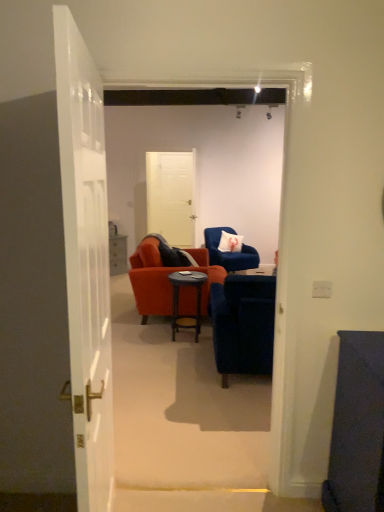
Question: In terms of width, does white glossy door at left, marked as the first door in a front-to-back arrangement, look wider or thinner when compared to velvet blue armchair at center, which appears as the 1th chair when viewed from the front?

Choices:
 (A) thin
 (B) wide

Answer: (A)

Question: From the image's perspective, is white glossy door at left, the 2th door viewed from the top, located above or below velvet blue armchair at center, the second chair viewed from the back?

Choices:
 (A) above
 (B) below

Answer: (A)

Question: Which object is the farthest from the white fabric pillow at center?

Choices:
 (A) white glossy door at left, the 2th door viewed from the top
 (B) velvet blue armchair at center, which is the 2th chair from front to back
 (C) velvet blue armchair at center, the second chair viewed from the back
 (D) dark wood side table at center
 (E) white matte door at center, the 2th door ordered from the bottom

Answer: (A)

Question: Which object is the farthest from the white fabric pillow at center?

Choices:
 (A) velvet blue armchair at center, the second chair viewed from the back
 (B) dark wood side table at center
 (C) white matte door at center, the 2th door ordered from the bottom
 (D) velvet blue armchair at center, marked as the first chair in a back-to-front arrangement
 (E) white glossy door at left, the 1th door from the bottom

Answer: (E)